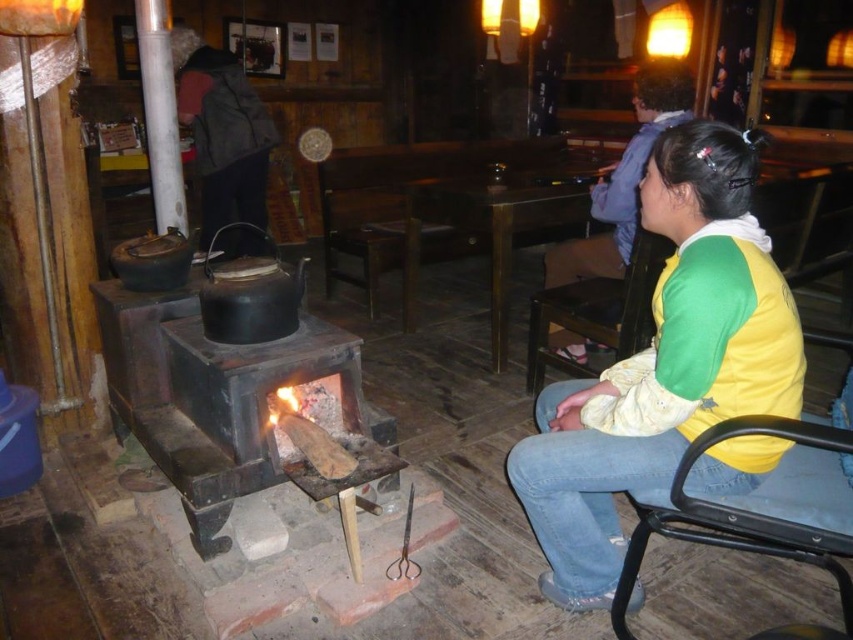
Between black plastic chair at lower right and yellow-green jacket at right, which one has less height?

Standing shorter between the two is black plastic chair at lower right.

Between point (688, 454) and point (628, 209), which one is positioned in front?

Positioned in front is point (688, 454).

At what (x,y) coordinates should I click in order to perform the action: click on black plastic chair at lower right. Please return your answer as a coordinate pair (x, y). Looking at the image, I should click on (758, 509).

Is yellow-green fabric jacket at lower right wider than yellow-green fabric chair at lower right?

Yes, yellow-green fabric jacket at lower right is wider than yellow-green fabric chair at lower right.

Which of these two, yellow-green fabric jacket at lower right or yellow-green fabric chair at lower right, stands taller?

yellow-green fabric jacket at lower right

Is point (666, 484) farther from viewer compared to point (602, 352)?

No.

The height and width of the screenshot is (640, 853). I want to click on yellow-green fabric jacket at lower right, so click(664, 364).

Is point (608, 173) positioned in front of point (537, 330)?

That is False.

Does yellow-green jacket at right have a lesser height compared to yellow-green fabric chair at lower right?

In fact, yellow-green jacket at right may be taller than yellow-green fabric chair at lower right.

Does point (618, 236) come in front of point (640, 348)?

No, it is not.

Image resolution: width=853 pixels, height=640 pixels. What are the coordinates of `yellow-green jacket at right` in the screenshot? It's located at (624, 177).